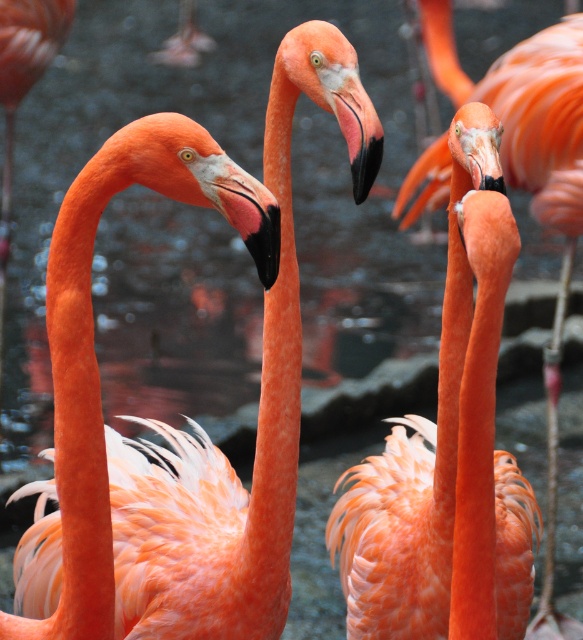
Question: Can you confirm if matte orange flamingo at center is positioned above black matte beak at center?

Choices:
 (A) yes
 (B) no

Answer: (B)

Question: Is orange feathered flamingo at center wider than black matte beak at center?

Choices:
 (A) yes
 (B) no

Answer: (A)

Question: Is matte orange flamingo at center positioned in front of orange feathered flamingo at center?

Choices:
 (A) yes
 (B) no

Answer: (B)

Question: Which object is positioned farthest from the matte orange flamingo at center?

Choices:
 (A) orange feathered flamingo at center
 (B) black matte beak at center

Answer: (B)

Question: Which point is farther to the camera?

Choices:
 (A) (259, 572)
 (B) (395, 525)
 (C) (359, 154)

Answer: (B)

Question: Which of the following is the closest to the observer?

Choices:
 (A) (145, 624)
 (B) (514, 490)
 (C) (354, 170)
 (D) (271, 278)

Answer: (D)